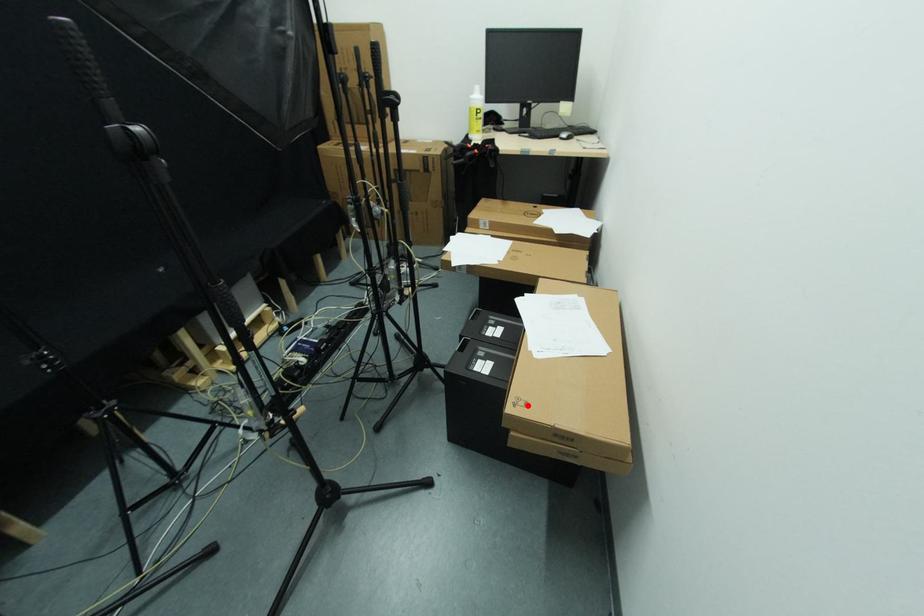
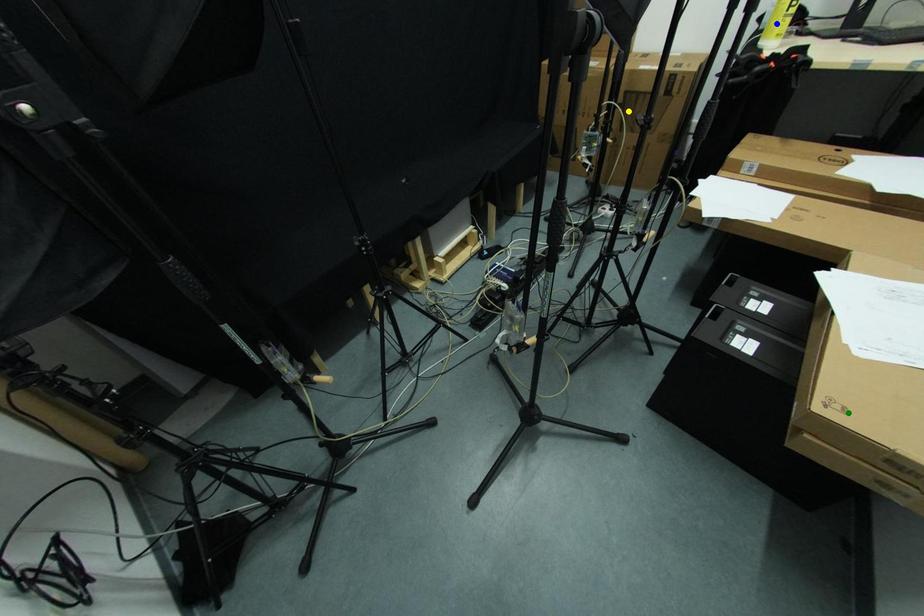
Question: I am providing you with two images of the same scene from different viewpoints. A red point is marked on the first image. You are given multiple points on the second image. Can you choose the point in image 2 that corresponds to the point in image 1?

Choices:
 (A) green point
 (B) yellow point
 (C) blue point

Answer: (A)